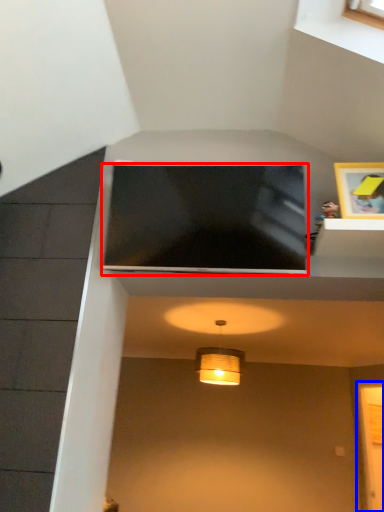
Question: Among these objects, which one is farthest to the camera, television (highlighted by a red box) or glass door (highlighted by a blue box)?

Choices:
 (A) television
 (B) glass door

Answer: (B)